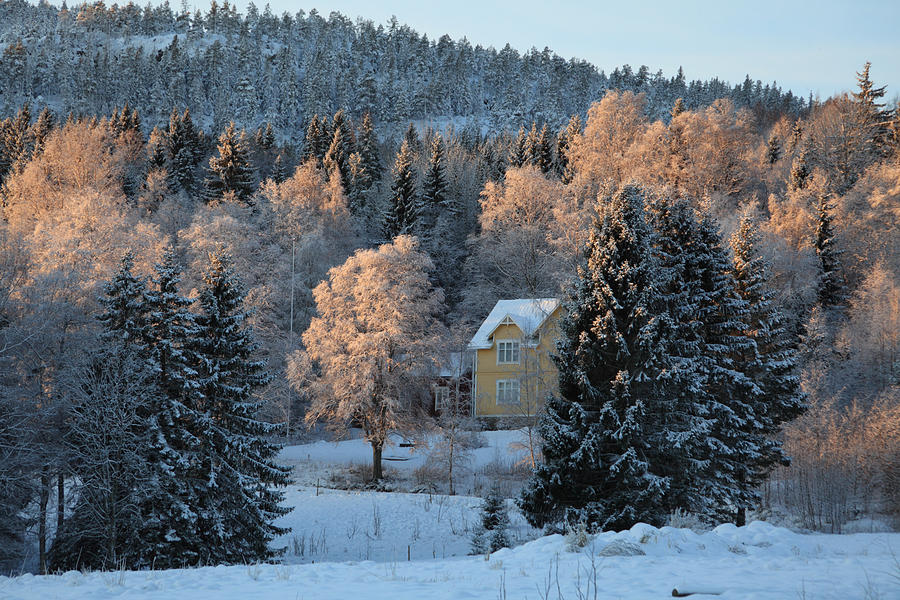
What are the coordinates of `windows` in the screenshot? It's located at (508, 395), (507, 350), (444, 396).